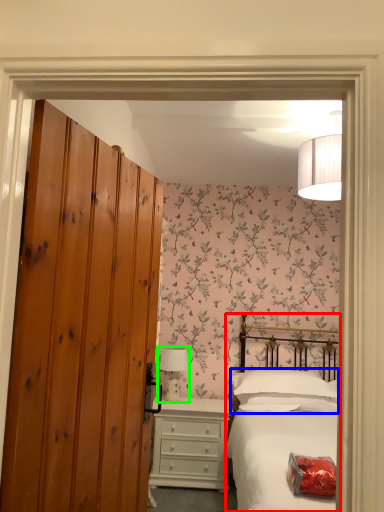
Question: Which is nearer to the bed (highlighted by a red box)? pillow (highlighted by a blue box) or table lamp (highlighted by a green box).

Choices:
 (A) pillow
 (B) table lamp

Answer: (A)